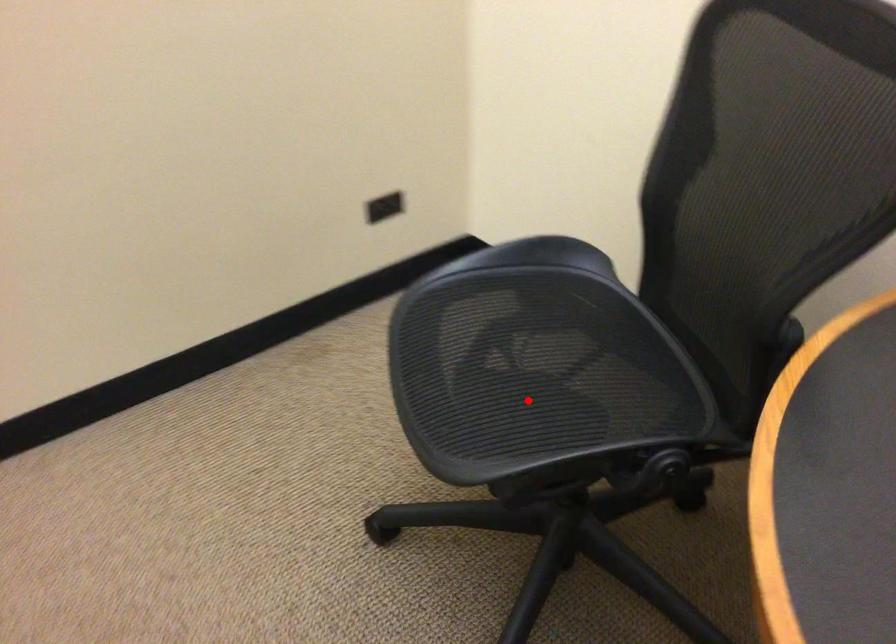
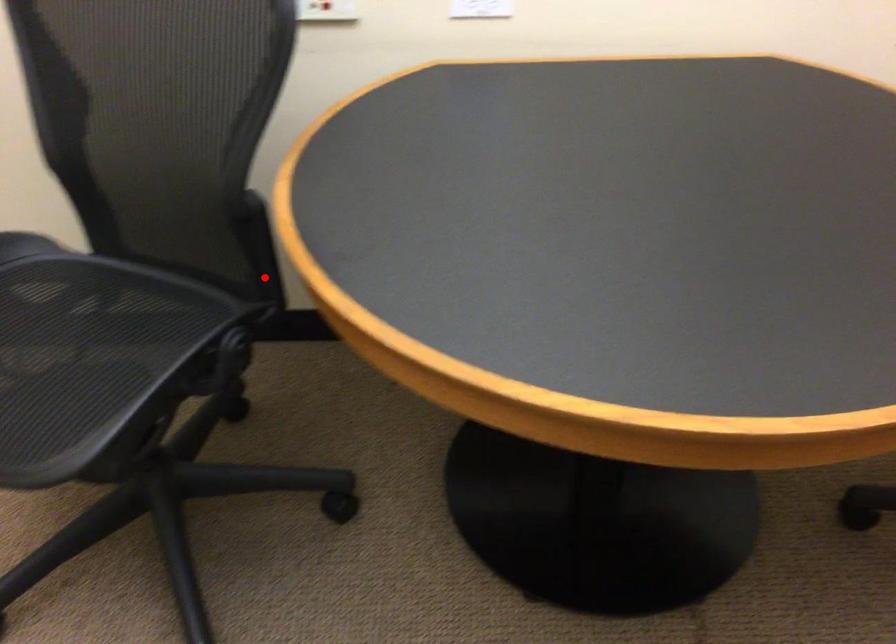
I am providing you with two images of the same scene from different viewpoints. A red point is marked on the first image and another point is marked on the second image. Is the marked point in image1 the same physical position as the marked point in image2?

No